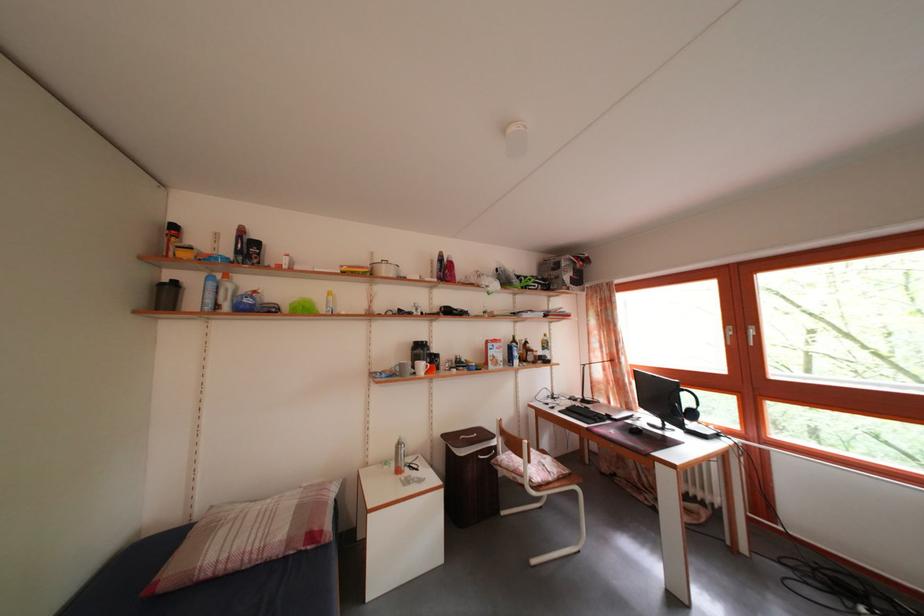
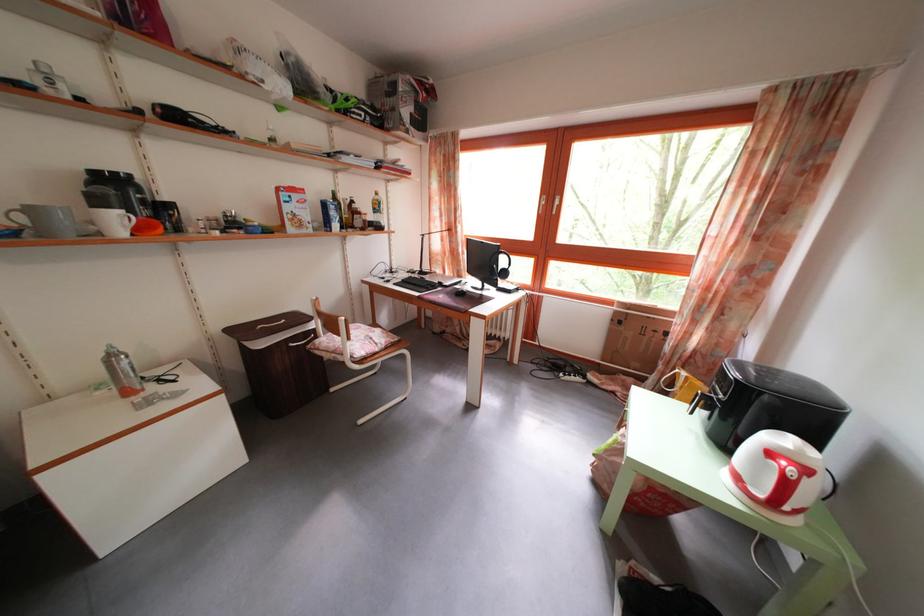
The point at (407,451) is marked in the first image. Where is the corresponding point in the second image?

(118, 363)